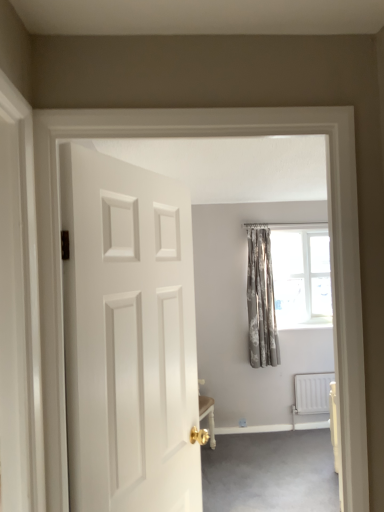
This screenshot has height=512, width=384. I want to click on free space above silver textured curtains at center (from a real-world perspective), so click(x=257, y=225).